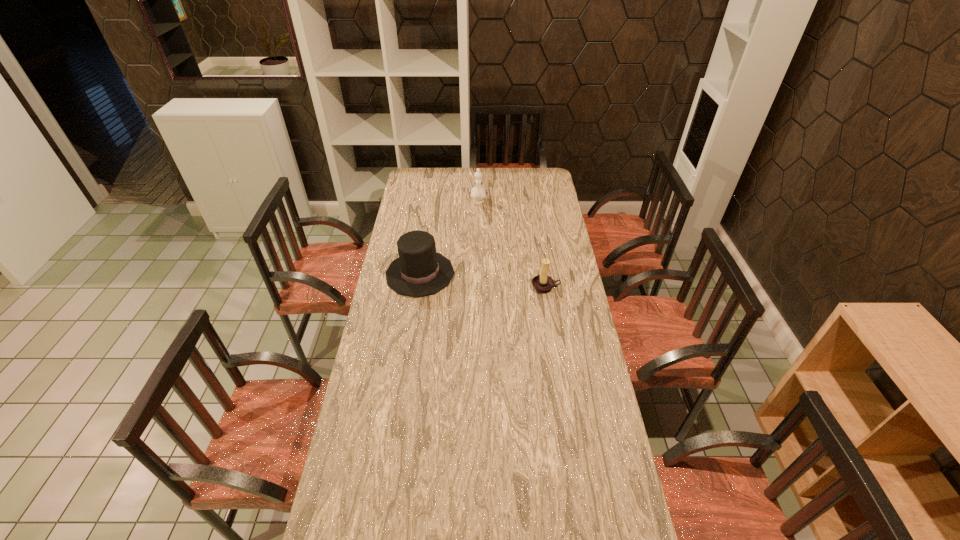
In the image, there is a desktop. At what (x,y) coordinates should I click in order to perform the action: click on vacant space at the left edge. Please return your answer as a coordinate pair (x, y). The image size is (960, 540). Looking at the image, I should click on (362, 369).

Find the location of `vacant space at the right edge of the desktop`. vacant space at the right edge of the desktop is located at coordinates (584, 537).

Find the location of a particular element. The width and height of the screenshot is (960, 540). vacant area that lies between the dress hat and the second object from left to right is located at coordinates (449, 238).

What are the coordinates of `free space between the second object from right to left and the candle holder` in the screenshot? It's located at (512, 245).

Find the location of `object that is the second closest to the farthest object`. object that is the second closest to the farthest object is located at coordinates (542, 283).

Select which object is the closest to the dress hat. Please provide its 2D coordinates. Your answer should be formatted as a tuple, i.e. [(x, y)], where the tuple contains the x and y coordinates of a point satisfying the conditions above.

[(542, 283)]

What are the coordinates of `vacant space that satisfies the following two spatial constraints: 1. at the spout of the chinaware; 2. on the front of the dress hat with the decoration` in the screenshot? It's located at (478, 274).

Identify the location of vacant space that satisfies the following two spatial constraints: 1. at the spout of the second object from left to right; 2. on the front of the leftmost object with the decoration. This screenshot has width=960, height=540. (478, 274).

The image size is (960, 540). I want to click on vacant space that satisfies the following two spatial constraints: 1. at the spout of the farthest object; 2. on the front of the dress hat with the decoration, so click(x=478, y=274).